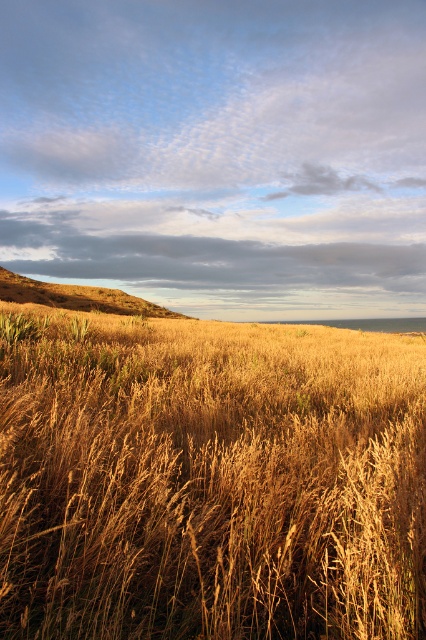
Can you confirm if golden dry grass at center is positioned below golden grassy hillside at upper left?

Yes.

Who is taller, golden dry grass at center or golden grassy hillside at upper left?

golden grassy hillside at upper left

The height and width of the screenshot is (640, 426). What are the coordinates of `golden dry grass at center` in the screenshot? It's located at (209, 481).